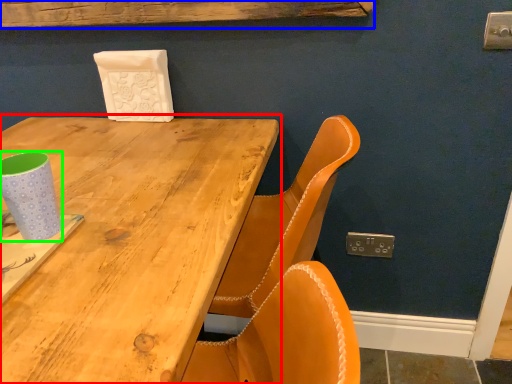
Question: Estimate the real-world distances between objects in this image. Which object is farther from table (highlighted by a red box), plank (highlighted by a blue box) or paper cup (highlighted by a green box)?

Choices:
 (A) plank
 (B) paper cup

Answer: (A)